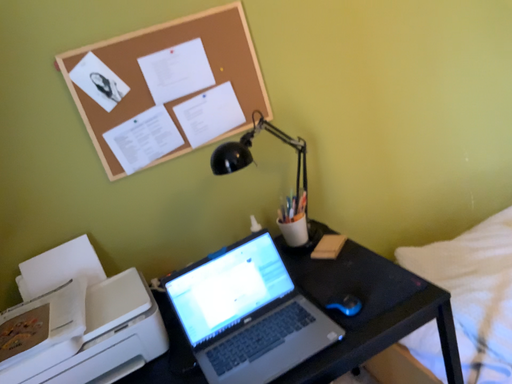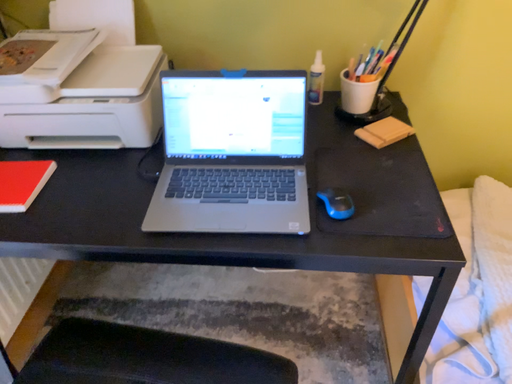
Question: How did the camera likely rotate when shooting the video?

Choices:
 (A) rotated downward
 (B) rotated upward

Answer: (A)